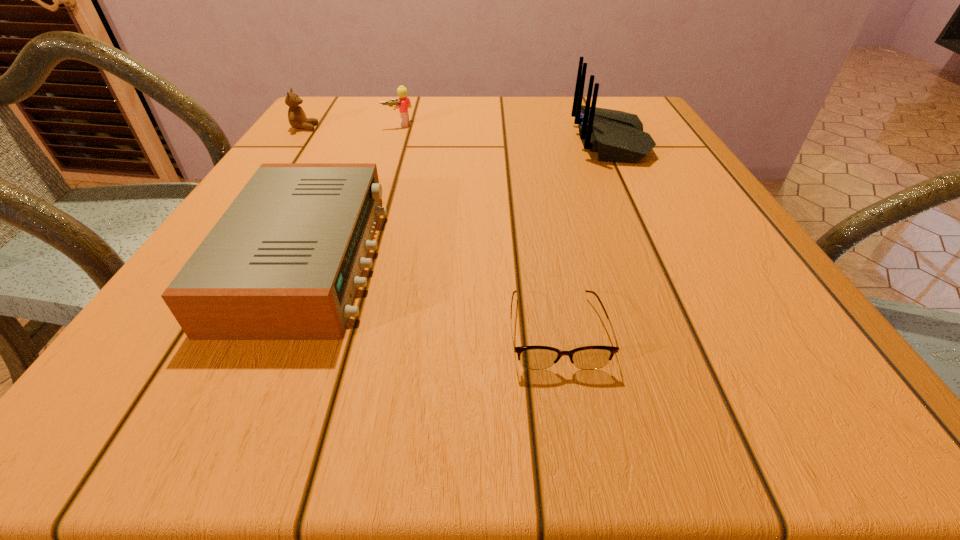
I want to click on free space located in front of the Lego with the accessory visible, so click(391, 149).

Identify the location of vacant position located 0.390m on the front-facing side of the leftmost object. (475, 127).

Identify the location of vacant area situated 0.140m on the control panel of the radio receiver. This screenshot has height=540, width=960. (464, 260).

Image resolution: width=960 pixels, height=540 pixels. I want to click on router that is at the far edge, so click(x=617, y=136).

In order to click on Lego that is at the far edge in this screenshot , I will do `click(404, 103)`.

At what (x,y) coordinates should I click in order to perform the action: click on teddy bear located at the far edge. Please return your answer as a coordinate pair (x, y). Looking at the image, I should click on (297, 118).

Identify the location of object that is at the near edge. The width and height of the screenshot is (960, 540). (531, 357).

This screenshot has width=960, height=540. Identify the location of teddy bear located in the left edge section of the desktop. (297, 118).

Find the location of a particular element. radio receiver that is at the left edge is located at coordinates (284, 261).

This screenshot has width=960, height=540. I want to click on object present at the right edge, so click(x=617, y=136).